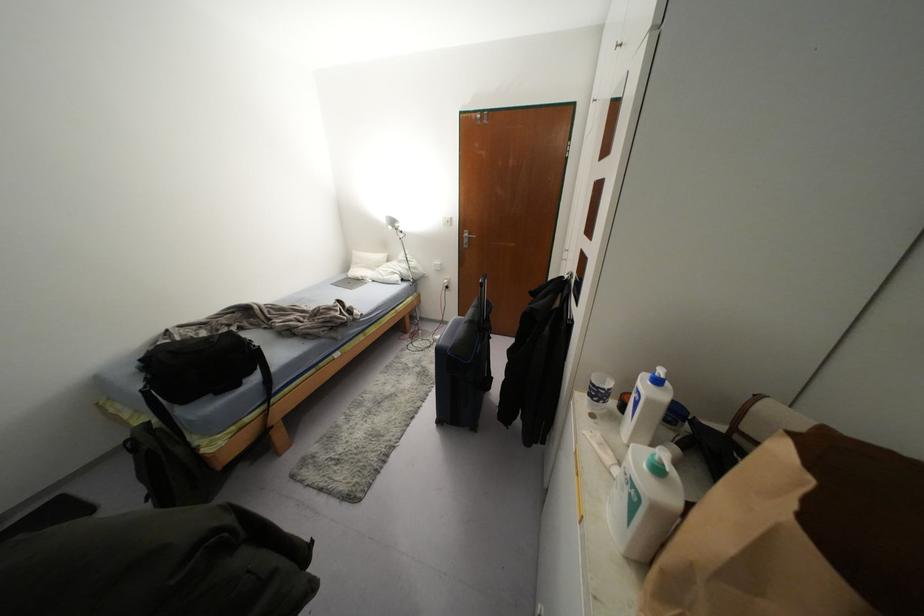
The location [349,283] corresponds to which object?

This point indicates the laptop computer.